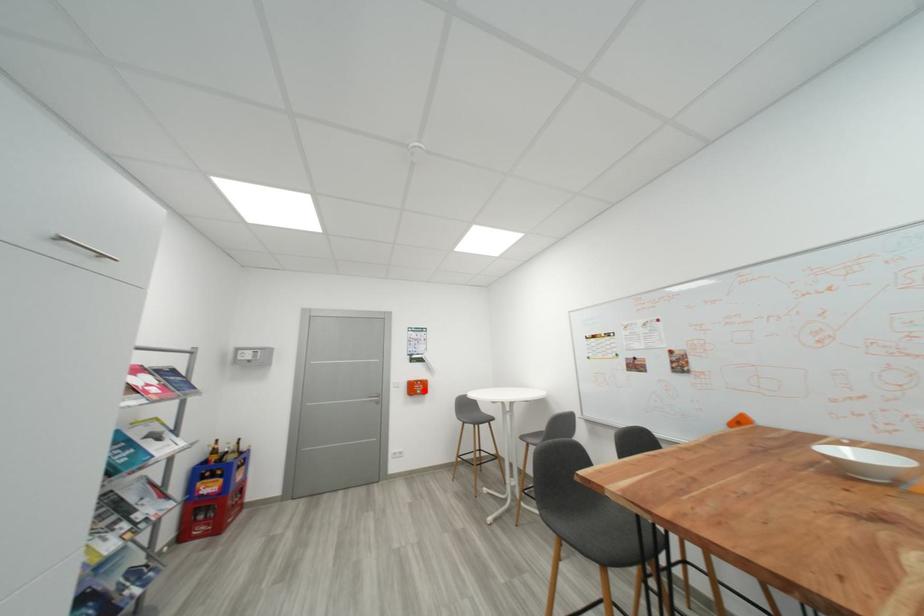
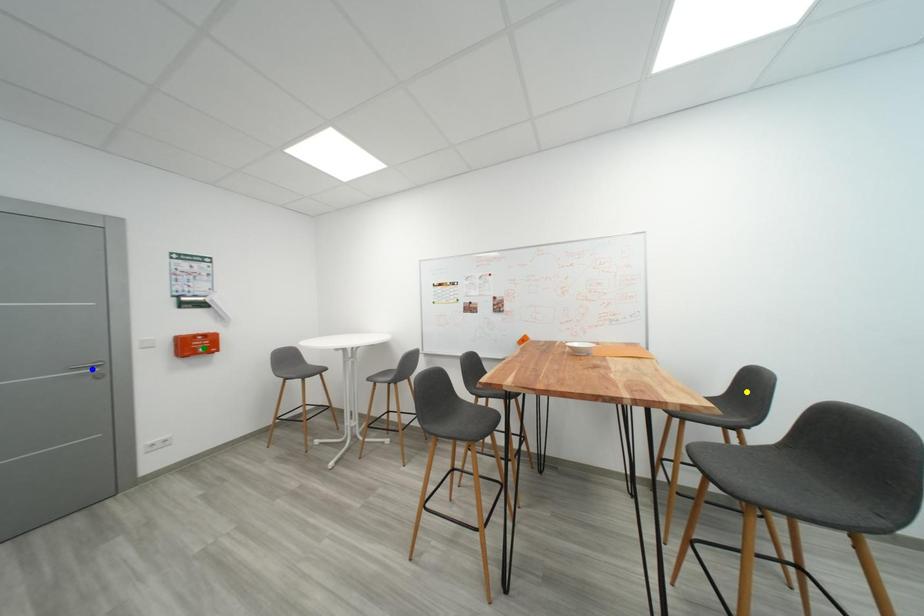
Question: I am providing you with two images of the same scene from different viewpoints. A red point is marked on the first image. You are given multiple points on the second image. In image 2, which mark is for the same physical point as the one in image 1?

Choices:
 (A) blue point
 (B) green point
 (C) yellow point

Answer: (B)